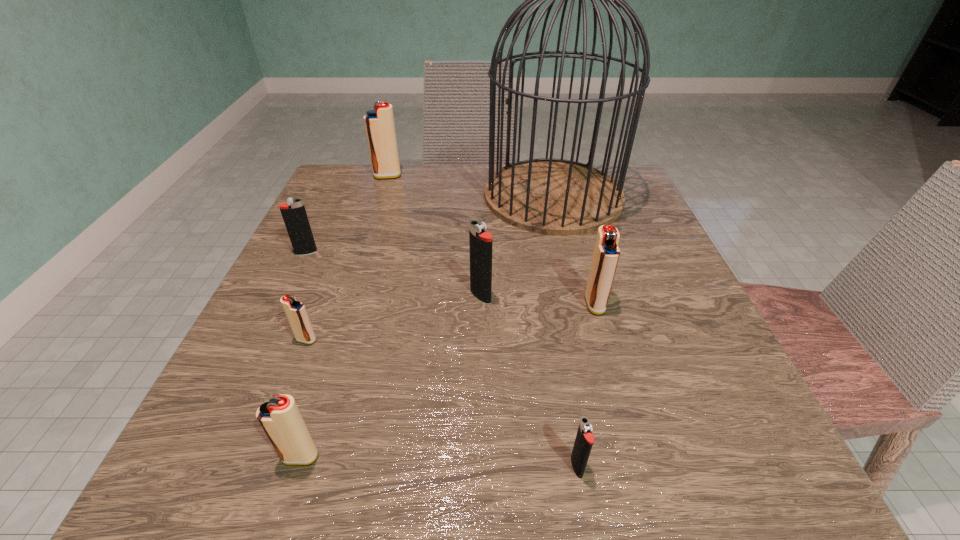
At what (x,y) coordinates should I click in order to perform the action: click on the tallest object. Please return your answer as a coordinate pair (x, y). The width and height of the screenshot is (960, 540). Looking at the image, I should click on point(547,196).

Locate an element on the screen. birdcage is located at coordinates (547, 196).

Locate an element on the screen. the farthest igniter is located at coordinates (379, 123).

This screenshot has height=540, width=960. Identify the location of the second tallest object. (379, 123).

This screenshot has width=960, height=540. What are the coordinates of `the rightmost red igniter` in the screenshot? It's located at (606, 254).

At what (x,y) coordinates should I click in order to perform the action: click on the second biggest red igniter. Please return your answer as a coordinate pair (x, y). Looking at the image, I should click on (606, 254).

The width and height of the screenshot is (960, 540). I want to click on the biggest black igniter, so click(x=480, y=241).

The image size is (960, 540). In order to click on the third igniter from right to left in this screenshot , I will do [x=480, y=241].

The width and height of the screenshot is (960, 540). I want to click on the sixth nearest igniter, so click(x=293, y=212).

Where is `the second biggest black igniter`? the second biggest black igniter is located at coordinates click(x=293, y=212).